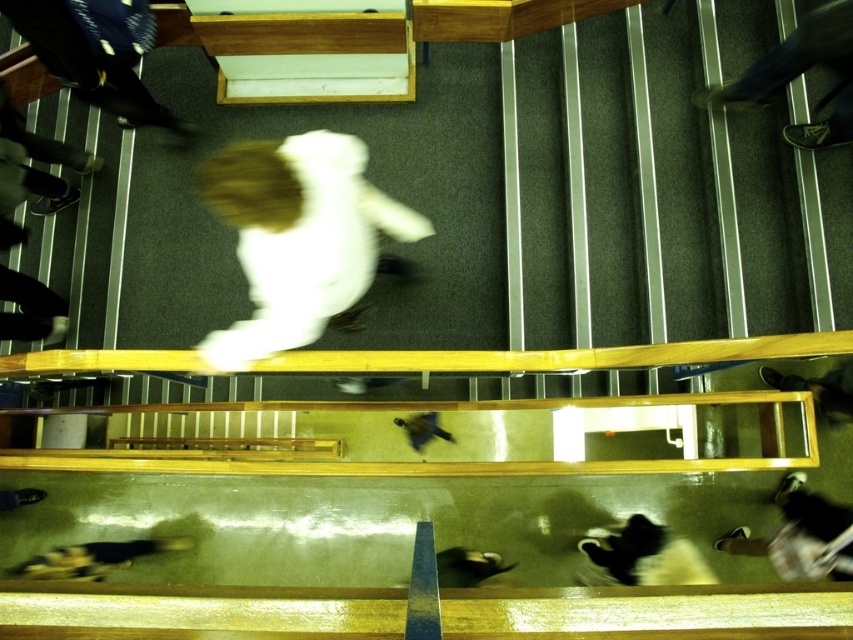
You are standing at the center of the staircase and notice the dark blue jeans at upper left. Based on their position, in which direction should you move to reach them?

The dark blue jeans at upper left is located at point (88,64), which is towards the upper left direction from your current position at the center. Move towards the upper left to reach them.

You are standing on the upper floor looking down at the staircase. You see a black fur dog at lower left and dark brown leather shoes at lower right. Which object is closer to you?

The black fur dog at lower left is closer to you because it is further to the viewer than the dark brown leather shoes at lower right.

You are a photographer trying to capture a clear shot of the dark blue jeans at upper left and dark brown leather shoes at lower right in this image. Considering their sizes, which object would be easier to focus on and why?

The dark blue jeans at upper left is larger in size than the dark brown leather shoes at lower right, so it would be easier to focus on the dark blue jeans at upper left because larger objects generally provide more details for the camera to lock onto.